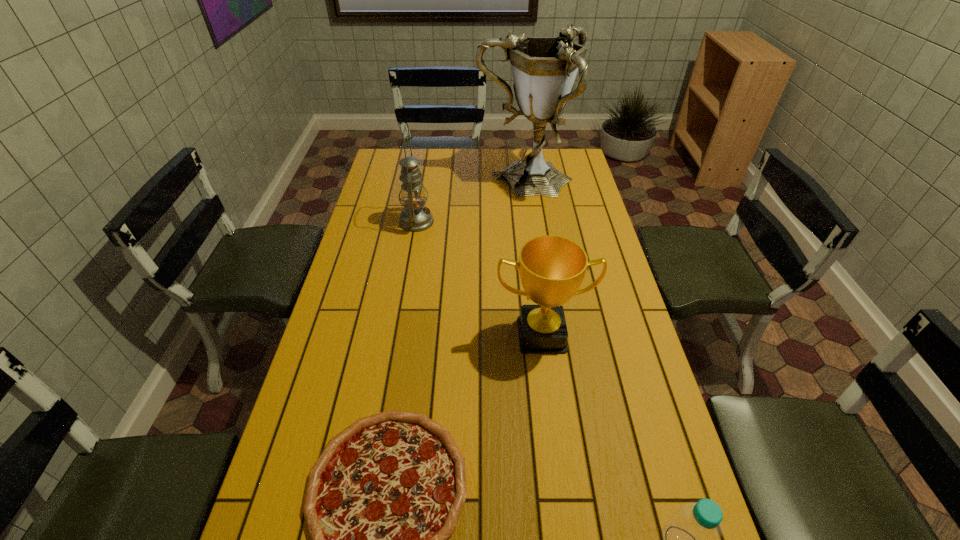
Identify the location of trophy cup. (544, 69).

At what (x,y) coordinates should I click in order to perform the action: click on oil lamp. Please return your answer as a coordinate pair (x, y). This screenshot has height=540, width=960. Looking at the image, I should click on (415, 217).

The image size is (960, 540). Identify the location of the third shortest object. (552, 268).

Locate an element on the screen. Image resolution: width=960 pixels, height=540 pixels. the third farthest object is located at coordinates (552, 268).

Image resolution: width=960 pixels, height=540 pixels. In order to click on vacant space located 0.230m on the left of the tallest object in this screenshot , I will do `click(421, 182)`.

Find the location of a particular element. The width and height of the screenshot is (960, 540). blank area located 0.100m on the back of the fourth shortest object is located at coordinates 421,194.

This screenshot has height=540, width=960. Identify the location of free spot located 0.330m on the front-facing side of the third farthest object. (561, 482).

Where is `object present at the far edge`? object present at the far edge is located at coordinates (544, 69).

I want to click on object at the left edge, so click(415, 217).

Locate an element on the screen. The width and height of the screenshot is (960, 540). trophy cup that is at the right edge is located at coordinates (544, 69).